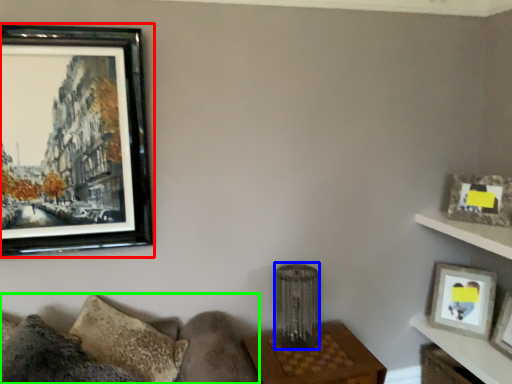
Question: Considering the real-world distances, which object is closest to picture frame (highlighted by a red box)? lamp (highlighted by a blue box) or couch (highlighted by a green box).

Choices:
 (A) lamp
 (B) couch

Answer: (B)